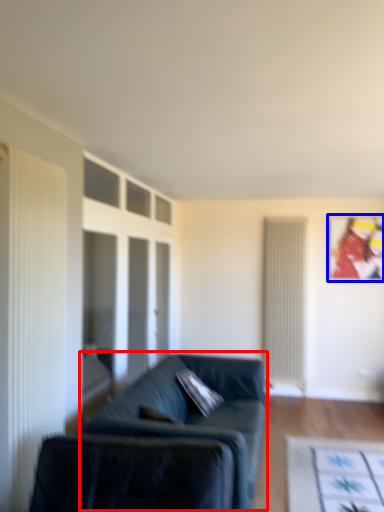
Question: Among these objects, which one is nearest to the camera, studio couch (highlighted by a red box) or picture frame (highlighted by a blue box)?

Choices:
 (A) studio couch
 (B) picture frame

Answer: (A)